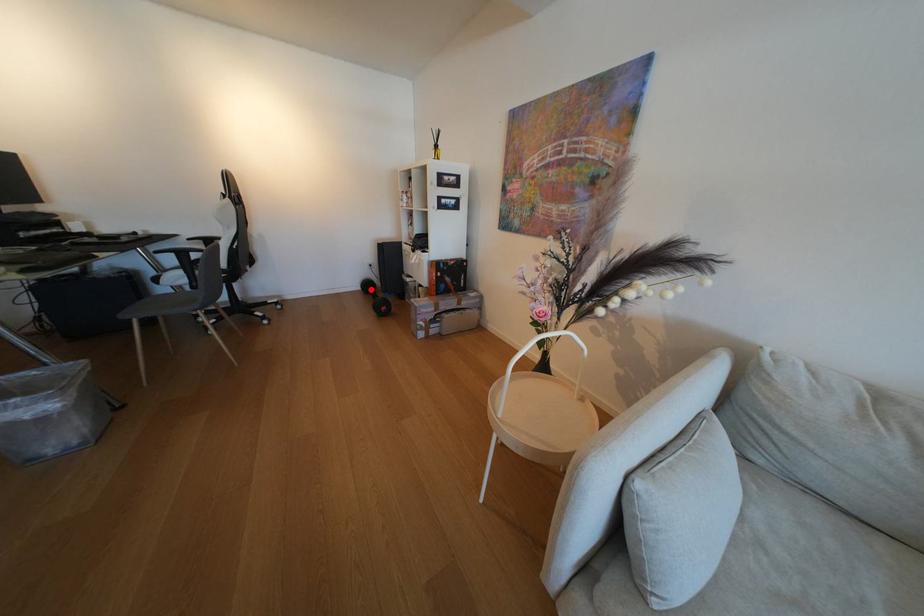
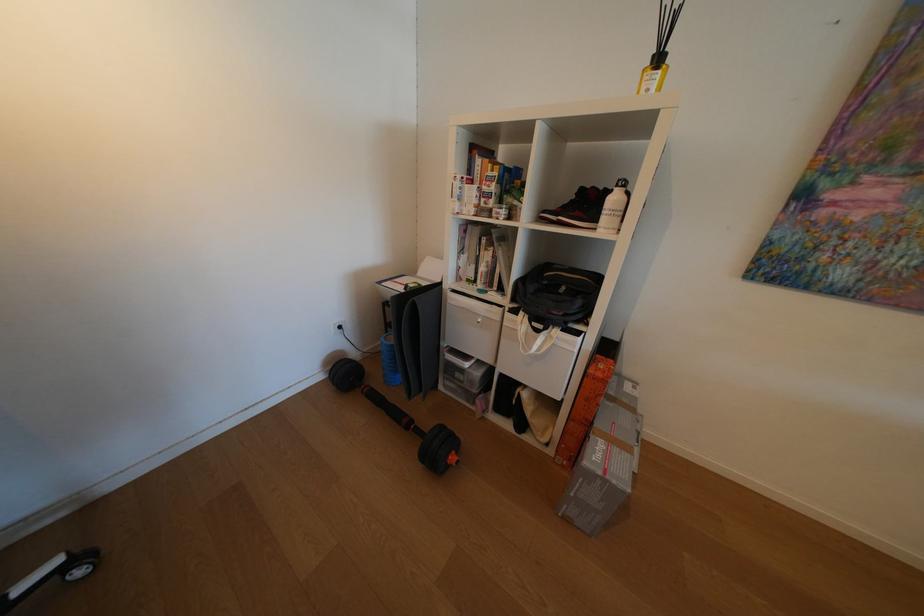
In the second image, find the point that corresponds to the highlighted location in the first image.

(331, 379)